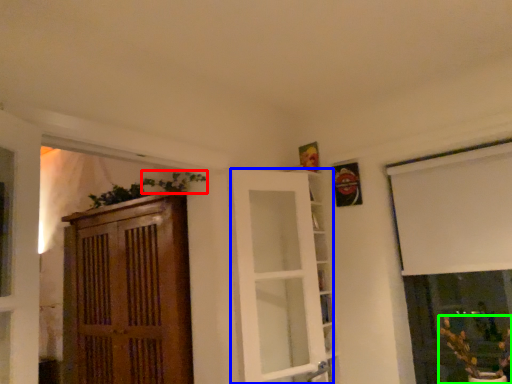
Question: Which is farther away from plant (highlighted by a red box)? door (highlighted by a blue box) or houseplant (highlighted by a green box)?

Choices:
 (A) door
 (B) houseplant

Answer: (B)